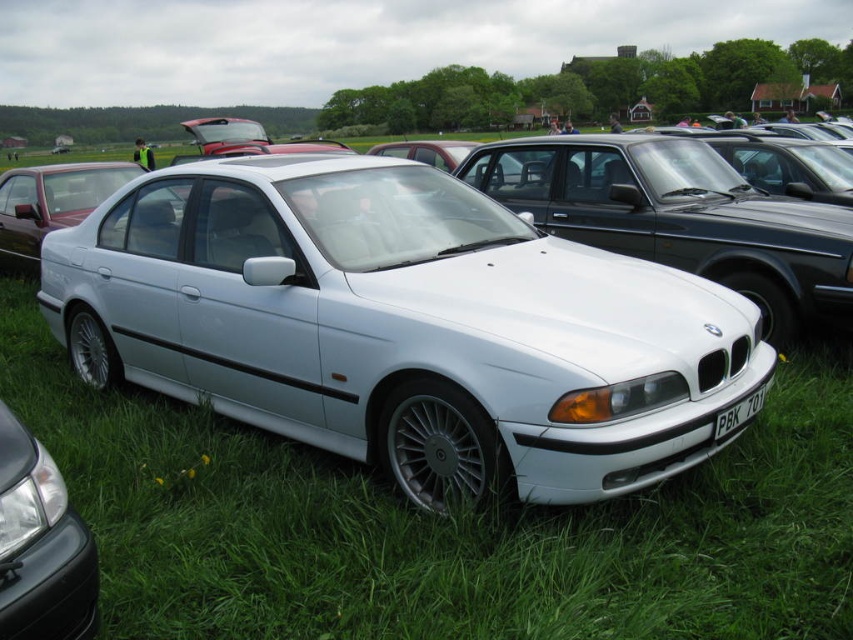
Does white metallic sedan at center have a greater height compared to satin black headlight at lower left?

Indeed, white metallic sedan at center has a greater height compared to satin black headlight at lower left.

Who is more forward, (137, 333) or (62, 556)?

Positioned in front is point (62, 556).

You are a GUI agent. You are given a task and a screenshot of the screen. Output one action in this format:
    pyautogui.click(x=<x>, y=<y>)
    Task: Click on the white metallic sedan at center
    
    Given the screenshot: What is the action you would take?
    pyautogui.click(x=401, y=326)

Which is behind, point (521, 403) or point (715, 435)?

Point (715, 435)

This screenshot has height=640, width=853. I want to click on white metallic sedan at center, so pos(401,326).

Which is in front, point (12, 493) or point (721, 417)?

Positioned in front is point (12, 493).

Does point (61, 552) come in front of point (750, 392)?

Yes, it is.

I want to click on satin black headlight at lower left, so click(x=39, y=545).